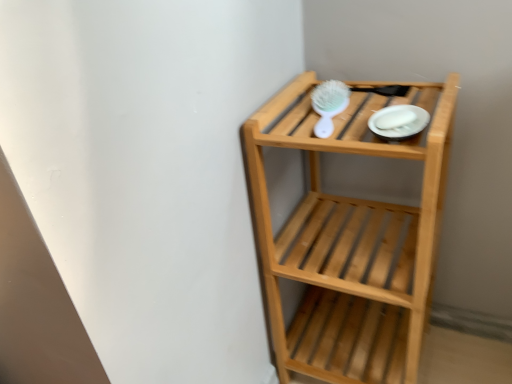
The image size is (512, 384). What do you see at coordinates (329, 105) in the screenshot?
I see `white plastic brush at upper center` at bounding box center [329, 105].

Locate an element on the screen. The width and height of the screenshot is (512, 384). natural wood shelf at upper right is located at coordinates (350, 239).

Image resolution: width=512 pixels, height=384 pixels. In order to click on white glossy plate at upper right in this screenshot , I will do `click(398, 122)`.

From the picture: Could you tell me if white glossy plate at upper right is turned towards natural wood shelf at upper right?

Yes, white glossy plate at upper right is facing natural wood shelf at upper right.

Which object is wider, white glossy plate at upper right or natural wood shelf at upper right?

natural wood shelf at upper right is wider.

How many degrees apart are the facing directions of white glossy plate at upper right and natural wood shelf at upper right?

They differ by 0.466 degrees in their facing directions.

Would you consider white glossy plate at upper right to be distant from natural wood shelf at upper right?

No, there isn't a large distance between white glossy plate at upper right and natural wood shelf at upper right.

Are natural wood shelf at upper right and white plastic brush at upper center making contact?

No, natural wood shelf at upper right is not making contact with white plastic brush at upper center.

Could you tell me if natural wood shelf at upper right is turned towards white plastic brush at upper center?

No, natural wood shelf at upper right is not turned towards white plastic brush at upper center.

Between natural wood shelf at upper right and white plastic brush at upper center, which one has smaller width?

Thinner between the two is white plastic brush at upper center.

From a real-world perspective, which is physically below, natural wood shelf at upper right or white plastic brush at upper center?

From a 3D spatial view, natural wood shelf at upper right is below.

Does natural wood shelf at upper right have a greater height compared to white glossy plate at upper right?

Yes.

Is white glossy plate at upper right surrounded by natural wood shelf at upper right?

Yes.

How many degrees apart are the facing directions of natural wood shelf at upper right and white glossy plate at upper right?

The angle between the facing direction of natural wood shelf at upper right and the facing direction of white glossy plate at upper right is 0.466 degrees.

I want to click on platter above the natural wood shelf at upper right (from the image's perspective), so click(398, 122).

Is white plastic brush at upper center looking in the opposite direction of natural wood shelf at upper right?

Yes, white plastic brush at upper center is facing away from natural wood shelf at upper right.

Is white plastic brush at upper center inside or outside of natural wood shelf at upper right?

The correct answer is: inside.

Can you tell me how much white plastic brush at upper center and natural wood shelf at upper right differ in facing direction?

5.11 degrees.

Is white plastic brush at upper center positioned before white glossy plate at upper right?

That is False.

Considering the sizes of objects white plastic brush at upper center and white glossy plate at upper right in the image provided, who is thinner, white plastic brush at upper center or white glossy plate at upper right?

white glossy plate at upper right.

From their relative heights in the image, would you say white glossy plate at upper right is taller or shorter than white plastic brush at upper center?

In the image, white glossy plate at upper right appears to be shorter than white plastic brush at upper center.

The height and width of the screenshot is (384, 512). Find the location of `platter lying below the white plastic brush at upper center (from the image's perspective)`. platter lying below the white plastic brush at upper center (from the image's perspective) is located at coordinates (398, 122).

Is white glossy plate at upper right with white plastic brush at upper center?

No, white glossy plate at upper right is not in contact with white plastic brush at upper center.

Locate an element on the screen. platter that appears above the natural wood shelf at upper right (from a real-world perspective) is located at coordinates (398, 122).

Locate an element on the screen. This screenshot has height=384, width=512. shelf in front of the white plastic brush at upper center is located at coordinates (350, 239).

When comparing their distances from white plastic brush at upper center, does white glossy plate at upper right or natural wood shelf at upper right seem further?

natural wood shelf at upper right is positioned further to the anchor white plastic brush at upper center.

When comparing their distances from natural wood shelf at upper right, does white glossy plate at upper right or white plastic brush at upper center seem further?

white glossy plate at upper right is further to natural wood shelf at upper right.

Based on their spatial positions, is white plastic brush at upper center or natural wood shelf at upper right further from white glossy plate at upper right?

Among the two, natural wood shelf at upper right is located further to white glossy plate at upper right.

Estimate the real-world distances between objects in this image. Which object is closer to white glossy plate at upper right, natural wood shelf at upper right or white plastic brush at upper center?

white plastic brush at upper center lies closer to white glossy plate at upper right than the other object.

Considering their positions, is white plastic brush at upper center positioned closer to natural wood shelf at upper right than white glossy plate at upper right?

white plastic brush at upper center is positioned closer to the anchor natural wood shelf at upper right.

From the image, which object appears to be nearer to white plastic brush at upper center, natural wood shelf at upper right or white glossy plate at upper right?

white glossy plate at upper right is closer to white plastic brush at upper center.

Where is `platter that lies between white plastic brush at upper center and natural wood shelf at upper right from top to bottom`? This screenshot has height=384, width=512. platter that lies between white plastic brush at upper center and natural wood shelf at upper right from top to bottom is located at coordinates (398, 122).